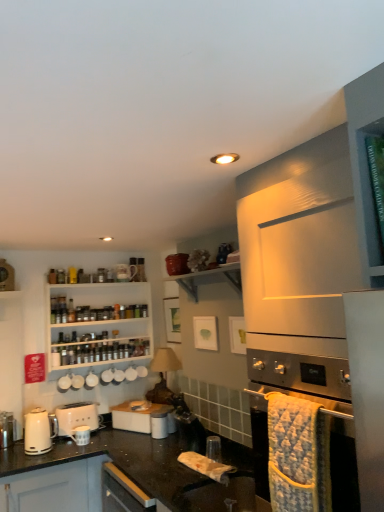
I want to click on free space in front of white glossy electric kettle at lower left, arranged as the 2th kitchen appliance when viewed from the back, so click(36, 461).